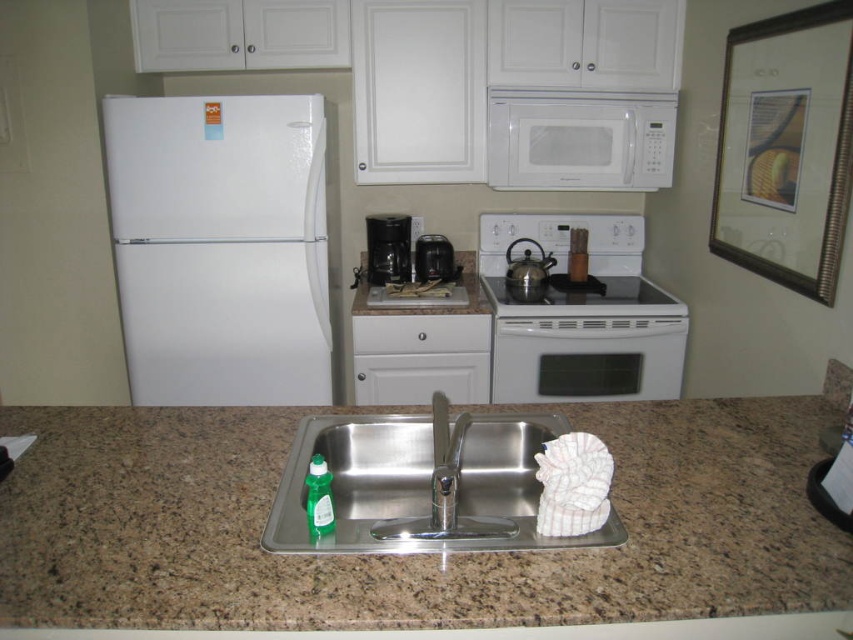
Is point (207, 337) more distant than point (456, 433)?

That is True.

Does white matte refrigerator at left have a lesser height compared to polished stainless steel faucet at center?

No, white matte refrigerator at left is not shorter than polished stainless steel faucet at center.

Does point (268, 168) come in front of point (453, 492)?

No, it is behind (453, 492).

This screenshot has width=853, height=640. What are the coordinates of `white matte refrigerator at left` in the screenshot? It's located at (219, 248).

Which is in front, point (489, 145) or point (440, 492)?

Point (440, 492) is more forward.

Who is higher up, white matte microwave at upper center or polished stainless steel faucet at center?

white matte microwave at upper center

Who is more forward, (x=589, y=99) or (x=433, y=465)?

Point (x=433, y=465) is more forward.

This screenshot has width=853, height=640. What are the coordinates of `white matte microwave at upper center` in the screenshot? It's located at tap(579, 140).

Who is more distant from viewer, (685, 346) or (415, 280)?

The point (415, 280) is behind.

Between point (636, 326) and point (425, 243), which one is positioned behind?

The point (425, 243) is more distant.

Identify the location of white glossy electric stove at upper center. This screenshot has width=853, height=640. (581, 316).